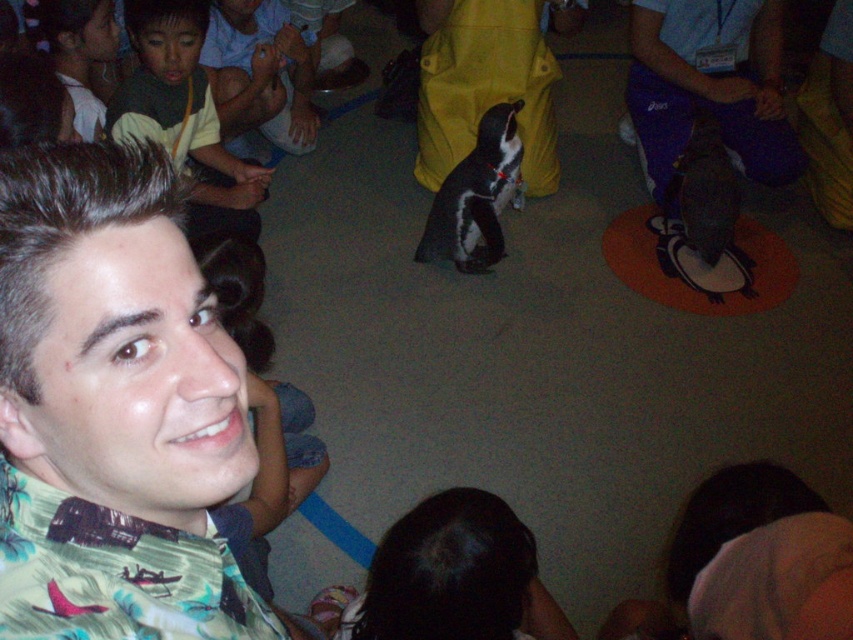
Question: Where is floral fabric shirt at center located in relation to light brown hair at upper left in the image?

Choices:
 (A) right
 (B) left

Answer: (A)

Question: Can you confirm if floral fabric shirt at center is thinner than matte green shirt at left?

Choices:
 (A) yes
 (B) no

Answer: (A)

Question: Which point appears closest to the camera in this image?

Choices:
 (A) (136, 120)
 (B) (68, 541)

Answer: (B)

Question: Which point is farther to the camera?

Choices:
 (A) (68, 64)
 (B) (193, 176)

Answer: (B)

Question: Which point appears closest to the camera in this image?

Choices:
 (A) (167, 8)
 (B) (51, 54)
 (C) (70, 499)

Answer: (C)

Question: In this image, where is floral fabric shirt at center located relative to light brown hair at upper left?

Choices:
 (A) left
 (B) right

Answer: (B)